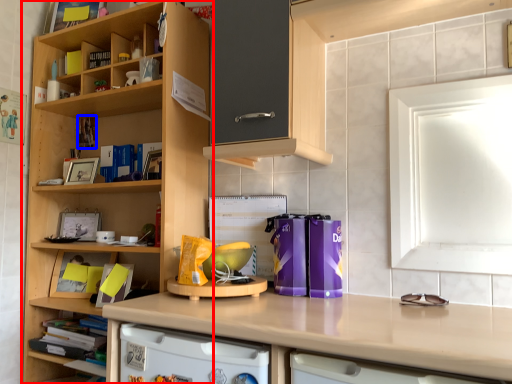
Question: Which object is closer to the camera taking this photo, cupboard (highlighted by a red box) or book (highlighted by a blue box)?

Choices:
 (A) cupboard
 (B) book

Answer: (A)